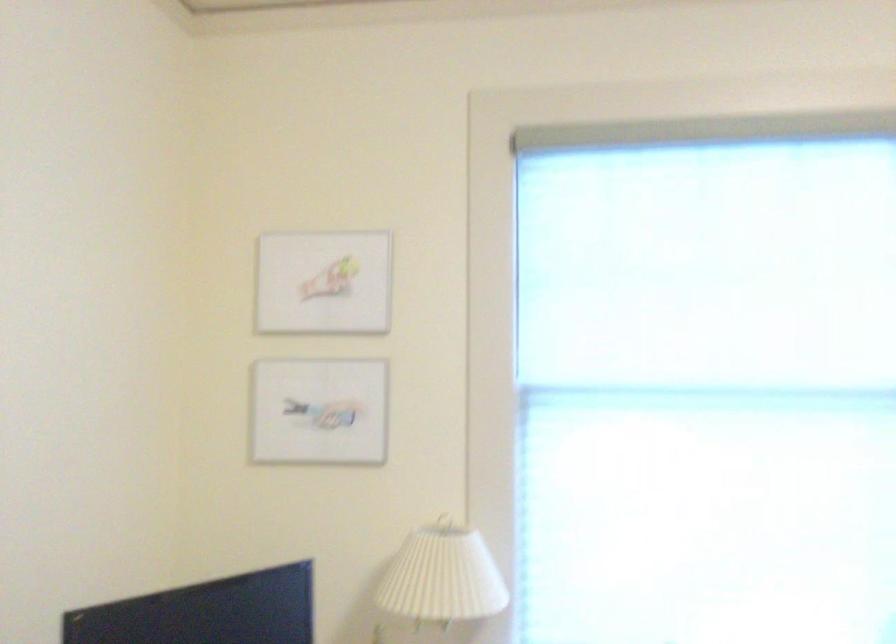
What do you see at coordinates (443, 576) in the screenshot? I see `the white lampshade` at bounding box center [443, 576].